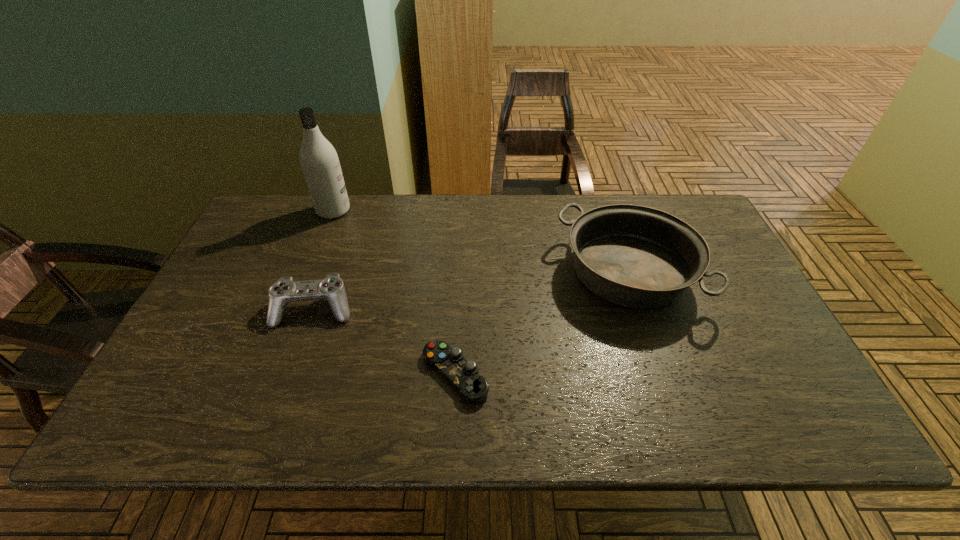
What are the coordinates of `the farthest object` in the screenshot? It's located at (320, 164).

Where is `shampoo`? The image size is (960, 540). shampoo is located at coordinates (320, 164).

Locate an element on the screen. the rightmost object is located at coordinates (635, 256).

The height and width of the screenshot is (540, 960). What are the coordinates of `pan` in the screenshot? It's located at (635, 256).

This screenshot has width=960, height=540. Identify the location of the farther control. (285, 290).

Locate an element on the screen. The width and height of the screenshot is (960, 540). the taller control is located at coordinates (285, 290).

At what (x,y) coordinates should I click in order to perform the action: click on the right control. Please return your answer as a coordinate pair (x, y). Image resolution: width=960 pixels, height=540 pixels. Looking at the image, I should click on (473, 388).

Identify the location of the shortest object. (473, 388).

Where is `vacant space situated on the front-facing side of the shampoo`? The image size is (960, 540). vacant space situated on the front-facing side of the shampoo is located at coordinates (378, 211).

The image size is (960, 540). I want to click on blank space located on the right of the pan, so click(x=737, y=273).